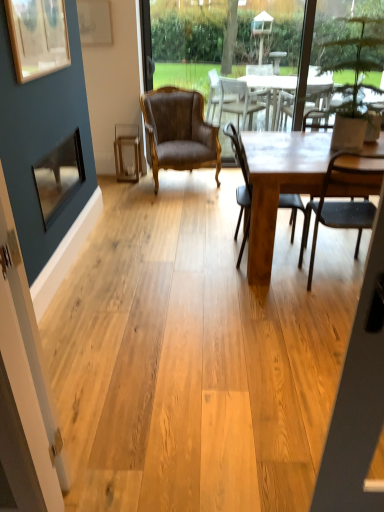
The image size is (384, 512). I want to click on vacant space positioned to the left of wooden table at center, so click(172, 264).